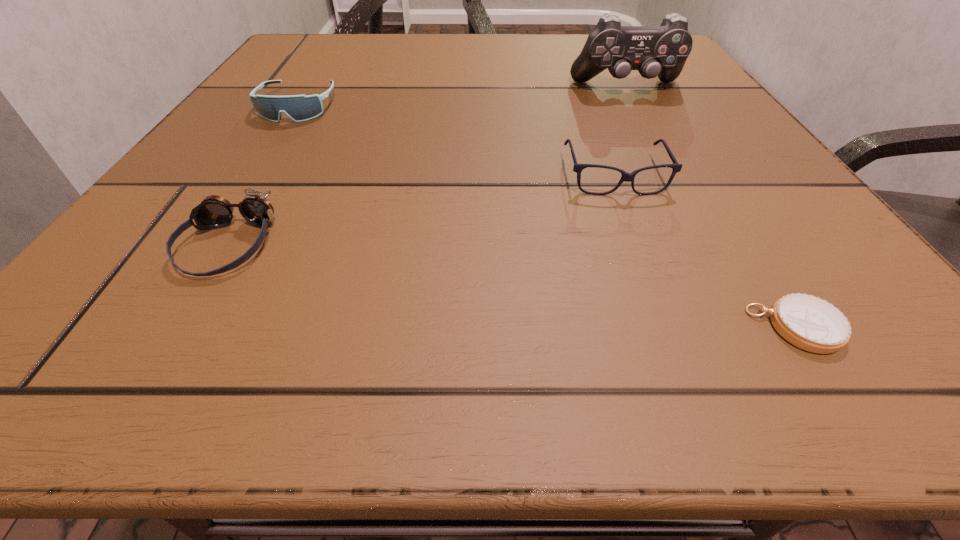
At what (x,y) coordinates should I click in order to perform the action: click on free space located 0.120m on the back of the compass. Please return your answer as a coordinate pair (x, y). The width and height of the screenshot is (960, 540). Looking at the image, I should click on (734, 228).

The height and width of the screenshot is (540, 960). Identify the location of object located in the near edge section of the desktop. [x=812, y=324].

This screenshot has width=960, height=540. What are the coordinates of `control that is positioned at the right edge` in the screenshot? It's located at (662, 51).

The height and width of the screenshot is (540, 960). Find the location of `compass present at the right edge`. compass present at the right edge is located at coordinates (812, 324).

You are a GUI agent. You are given a task and a screenshot of the screen. Output one action in this format:
    pyautogui.click(x=<x>, y=<y>)
    Task: Click on the object situated at the near right corner
    The height and width of the screenshot is (540, 960).
    Given the screenshot: What is the action you would take?
    pyautogui.click(x=812, y=324)

This screenshot has height=540, width=960. I want to click on free space at the far edge of the desktop, so click(386, 40).

The image size is (960, 540). In order to click on vacant space at the near edge in this screenshot , I will do `click(591, 332)`.

This screenshot has height=540, width=960. I want to click on vacant space at the right edge, so click(x=654, y=86).

Identify the location of free space at the far left corner. (352, 36).

Where is `empty space between the nearest object and the farther goggles`? The width and height of the screenshot is (960, 540). empty space between the nearest object and the farther goggles is located at coordinates (547, 217).